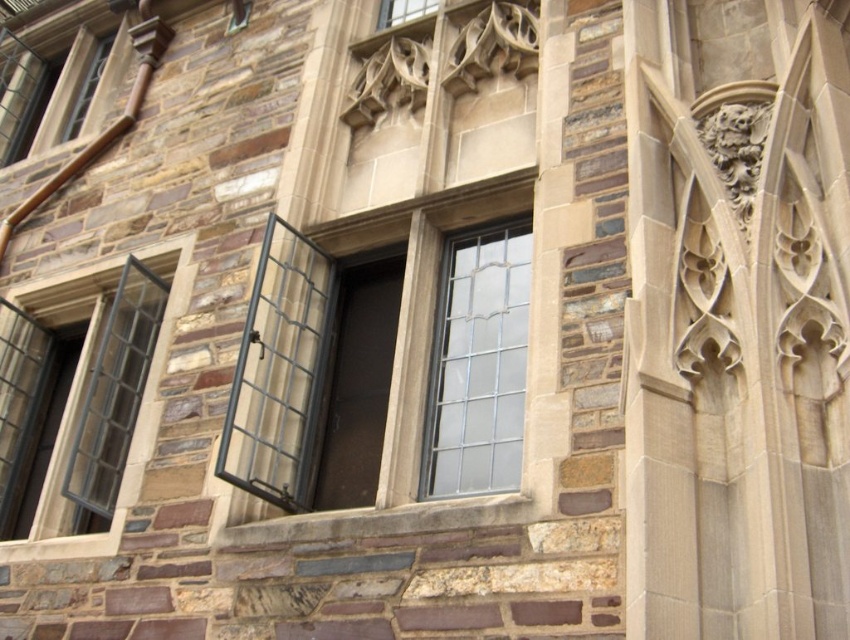
Can you confirm if clear glass window at center is taller than clear glass window at upper left?

Incorrect, clear glass window at center's height is not larger of clear glass window at upper left's.

Which is in front, point (500, 490) or point (64, 128)?

Positioned in front is point (500, 490).

Which is behind, point (496, 275) or point (91, 90)?

Positioned behind is point (91, 90).

The image size is (850, 640). I want to click on clear glass window at center, so click(x=479, y=365).

What do you see at coordinates (75, 396) in the screenshot? I see `matte black window at lower left` at bounding box center [75, 396].

Who is shorter, matte black window at lower left or clear glass window at center?

clear glass window at center

Is point (109, 416) closer to camera compared to point (516, 412)?

No, it is behind (516, 412).

You are a GUI agent. You are given a task and a screenshot of the screen. Output one action in this format:
    pyautogui.click(x=<x>, y=<y>)
    Task: Click on the matte black window at lower left
    This screenshot has height=640, width=850.
    Given the screenshot: What is the action you would take?
    pyautogui.click(x=75, y=396)

Is clear glass window at center smaller than clear glass window at upper center?

Yes.

Does point (524, 268) lie in front of point (398, 13)?

Yes, point (524, 268) is in front of point (398, 13).

Which is in front, point (479, 365) or point (412, 8)?

Point (479, 365) is in front.

At what (x,y) coordinates should I click in order to perform the action: click on clear glass window at center. Please return your answer as a coordinate pair (x, y). Looking at the image, I should click on (479, 365).